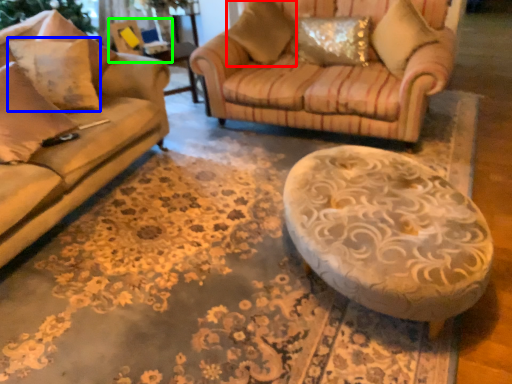
Question: Based on their relative distances, which object is nearer to pillow (highlighted by a red box)? Choose from pillow (highlighted by a blue box) and swivel chair (highlighted by a green box).

Choices:
 (A) pillow
 (B) swivel chair

Answer: (B)